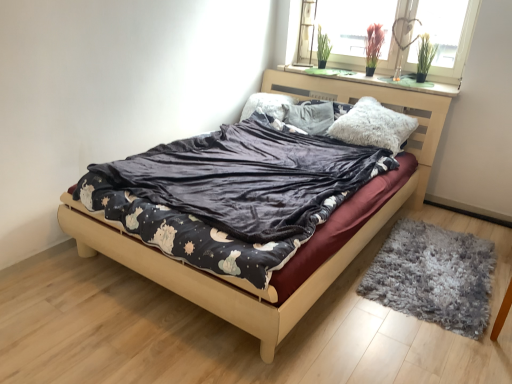
Where is `vacant space underneath gray shaggy rug at lower right (from a real-world perspective)`? The image size is (512, 384). vacant space underneath gray shaggy rug at lower right (from a real-world perspective) is located at coordinates (431, 264).